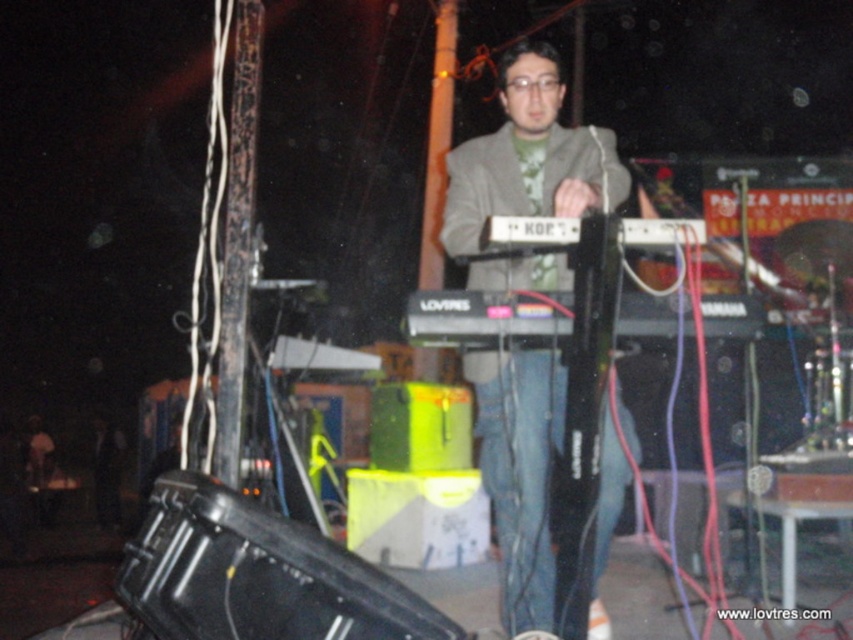
Question: Can you confirm if matte gray jacket at center is positioned to the right of black plastic keyboard at center?

Choices:
 (A) no
 (B) yes

Answer: (A)

Question: Is matte gray jacket at center thinner than black plastic keyboard at center?

Choices:
 (A) no
 (B) yes

Answer: (B)

Question: Is matte gray jacket at center behind black plastic keyboard at center?

Choices:
 (A) no
 (B) yes

Answer: (B)

Question: Which point is closer to the camera taking this photo?

Choices:
 (A) (436, 323)
 (B) (453, 244)

Answer: (A)

Question: Which of the following is the farthest from the observer?

Choices:
 (A) (503, 468)
 (B) (531, 296)

Answer: (A)